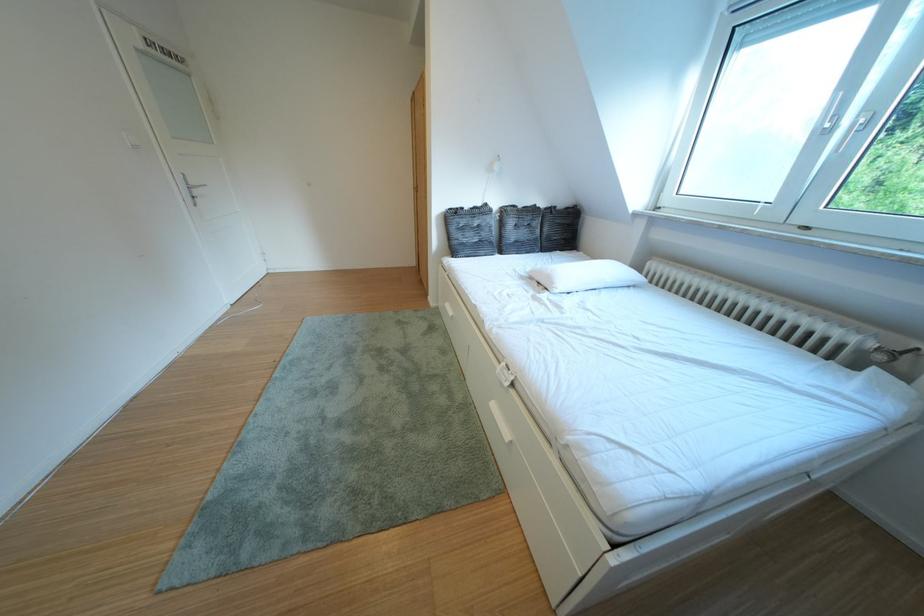
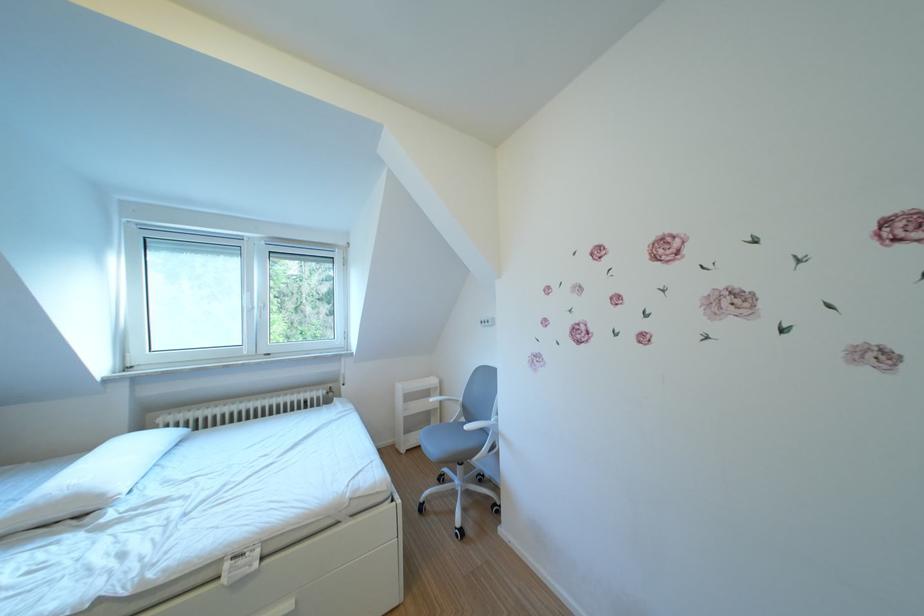
Locate, in the second image, the point that corresponds to point (565, 288) in the first image.

(115, 501)